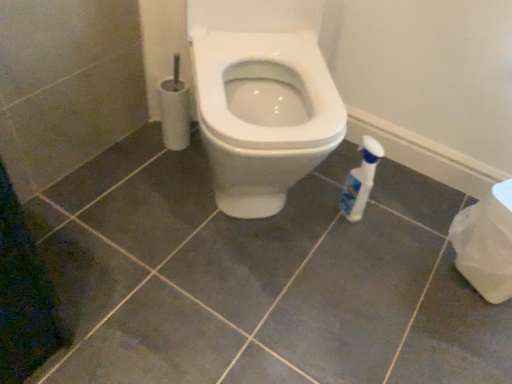
Find the location of `free spot to the right of white plastic spray bottle at lower right`. free spot to the right of white plastic spray bottle at lower right is located at coordinates (401, 220).